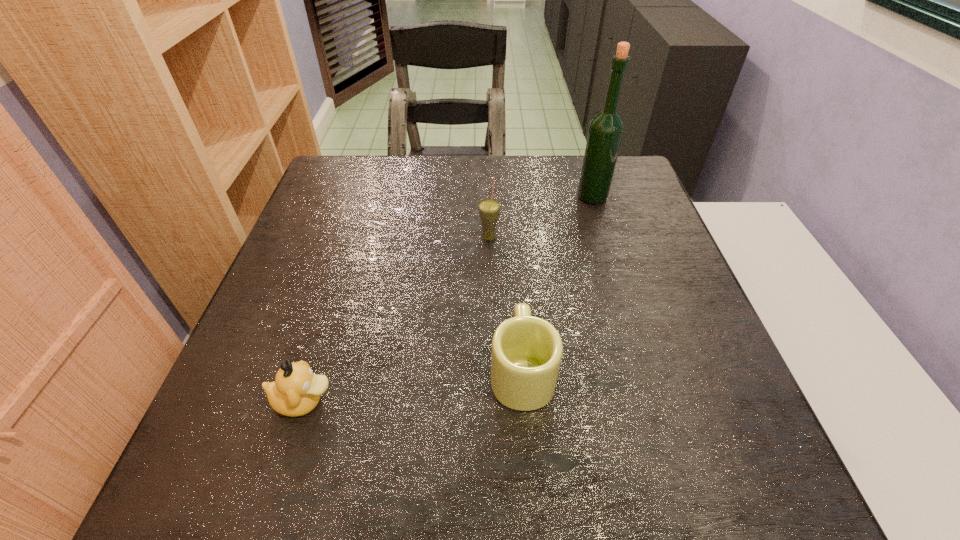
This screenshot has width=960, height=540. What are the coordinates of `free space between the third nearest object and the farthest object` in the screenshot? It's located at (540, 217).

Locate an element on the screen. The width and height of the screenshot is (960, 540). object that ranks as the second closest to the farthest object is located at coordinates (526, 354).

Find the location of `the closest object to the leftmost object`. the closest object to the leftmost object is located at coordinates (526, 354).

Locate an element on the screen. The width and height of the screenshot is (960, 540). free space that satisfies the following two spatial constraints: 1. with the handle on the side of the mug; 2. on the left side of the rightmost object is located at coordinates (508, 197).

Find the location of a particular element. This screenshot has height=540, width=960. vacant region that satisfies the following two spatial constraints: 1. with the handle on the side of the mug; 2. on the right side of the farthest object is located at coordinates (508, 197).

At what (x,y) coordinates should I click in order to perform the action: click on vacant position in the image that satisfies the following two spatial constraints: 1. on the front side of the straw for drinking; 2. on the face of the duckling. Please return your answer as a coordinate pair (x, y). This screenshot has height=540, width=960. Looking at the image, I should click on (492, 401).

The image size is (960, 540). Find the location of `blank area in the image that satisfies the following two spatial constraints: 1. with the handle on the side of the mug; 2. on the right side of the rightmost object`. blank area in the image that satisfies the following two spatial constraints: 1. with the handle on the side of the mug; 2. on the right side of the rightmost object is located at coordinates (508, 197).